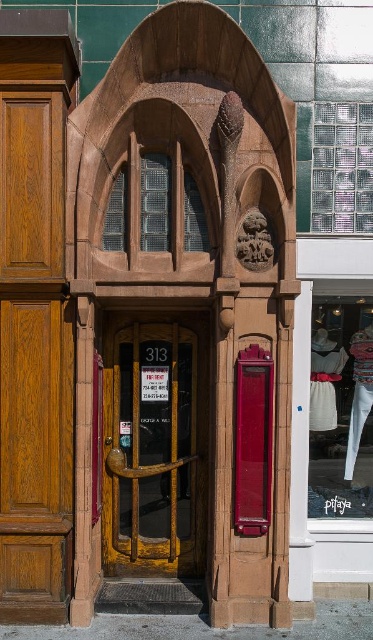
Question: Among these objects, which one is farthest from the camera?

Choices:
 (A) shiny red phone box at center
 (B) matte oak door at left
 (C) white fabric at lower right
 (D) yellow matte door at center

Answer: (C)

Question: Which object is farther from the camera taking this photo?

Choices:
 (A) shiny red phone box at center
 (B) white fabric at lower right

Answer: (B)

Question: Which of the following is the closest to the observer?

Choices:
 (A) matte oak door at left
 (B) white fabric at lower right
 (C) shiny red phone box at center

Answer: (C)

Question: Is yellow matte door at center smaller than shiny red phone box at center?

Choices:
 (A) no
 (B) yes

Answer: (A)

Question: Observing the image, what is the correct spatial positioning of matte oak door at left in reference to white fabric at lower right?

Choices:
 (A) above
 (B) below

Answer: (A)

Question: Can you confirm if matte oak door at left is thinner than white fabric at lower right?

Choices:
 (A) yes
 (B) no

Answer: (A)